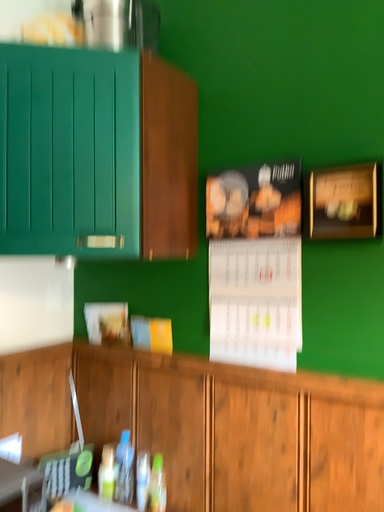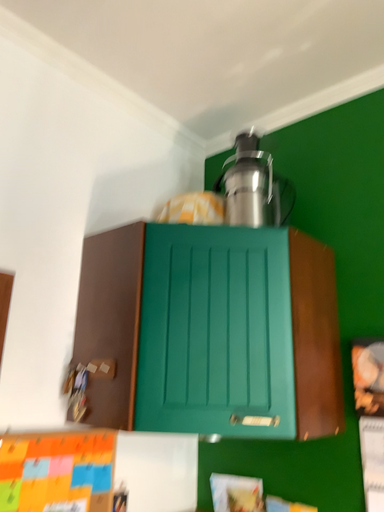
Question: How did the camera likely rotate when shooting the video?

Choices:
 (A) rotated left
 (B) rotated right

Answer: (A)